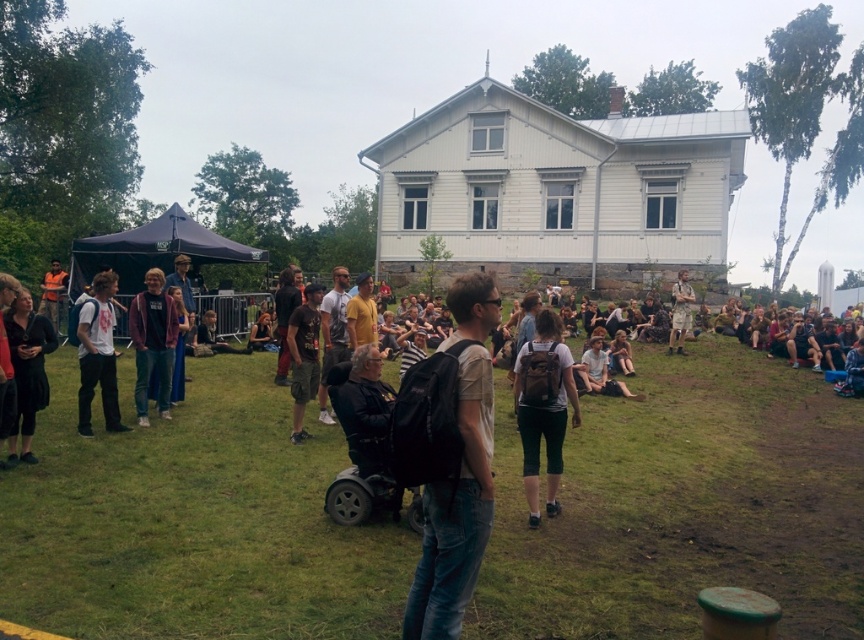
You are a photographer setting up a tripod to capture the scene in front of the large white two story house with a sloped roof and multiple windows. You notice the matte purple jacket at center and the khaki fabric shorts at center. Which item should you focus on to ensure the tripod is at the correct height for a centered composition?

The matte purple jacket at center is shorter than the khaki fabric shorts at center, so focusing on the khaki fabric shorts at center will ensure the tripod is at the correct height for a centered composition.